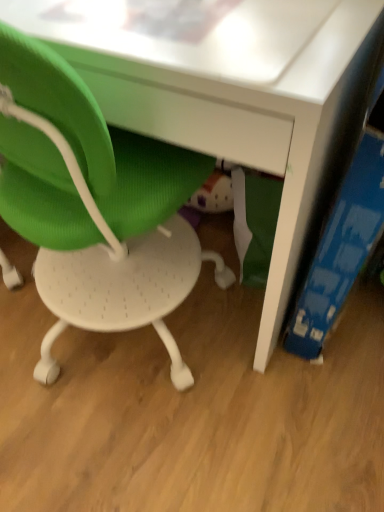
Question: Is green mesh chair at lower left spatially inside blue cardboard book at right, or outside of it?

Choices:
 (A) inside
 (B) outside

Answer: (B)

Question: Looking at their shapes, would you say green mesh chair at lower left is wider or thinner than blue cardboard book at right?

Choices:
 (A) wide
 (B) thin

Answer: (A)

Question: From a real-world perspective, is green mesh chair at lower left physically located above or below blue cardboard book at right?

Choices:
 (A) below
 (B) above

Answer: (B)

Question: Considering the positions of blue cardboard book at right and green mesh chair at lower left in the image, is blue cardboard book at right wider or thinner than green mesh chair at lower left?

Choices:
 (A) wide
 (B) thin

Answer: (B)

Question: Considering the positions of point (327, 225) and point (228, 282), is point (327, 225) closer or farther from the camera than point (228, 282)?

Choices:
 (A) closer
 (B) farther

Answer: (A)

Question: Is blue cardboard book at right to the left or to the right of green mesh chair at lower left in the image?

Choices:
 (A) right
 (B) left

Answer: (A)

Question: From their relative heights in the image, would you say blue cardboard book at right is taller or shorter than green mesh chair at lower left?

Choices:
 (A) tall
 (B) short

Answer: (B)